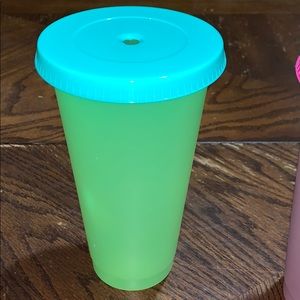
Locate an element on the screen. Image resolution: width=300 pixels, height=300 pixels. table is located at coordinates (222, 261).